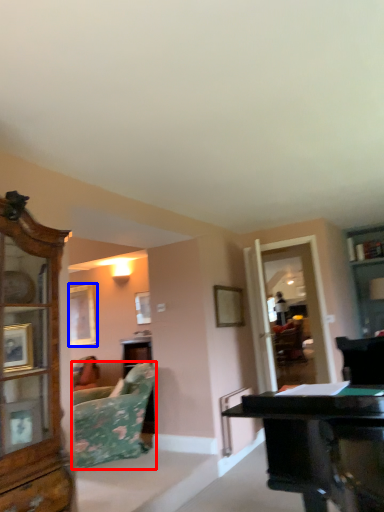
Question: Among these objects, which one is farthest to the camera, studio couch (highlighted by a red box) or picture frame (highlighted by a blue box)?

Choices:
 (A) studio couch
 (B) picture frame

Answer: (B)